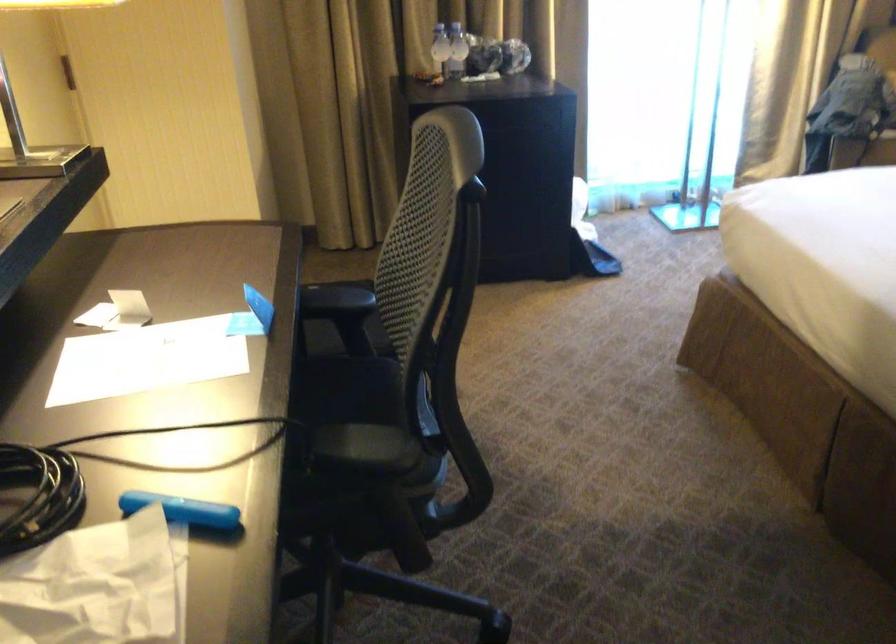
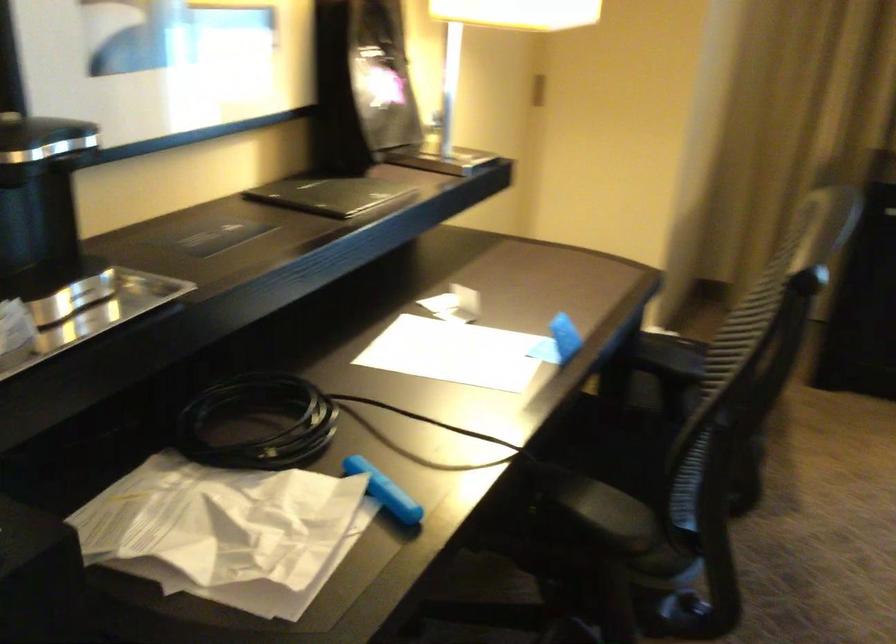
Find the pixel in the second image that matches (x=437, y=512) in the first image.

(679, 614)